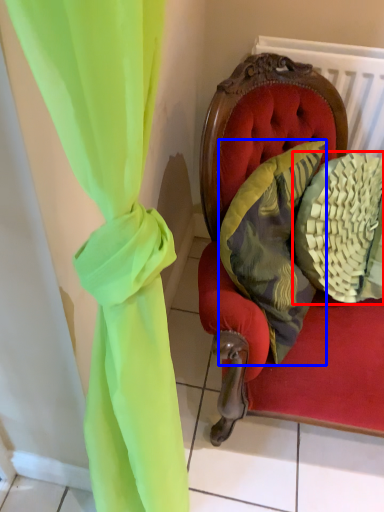
Question: Which point is further to the camera, pillow (highlighted by a red box) or pillow (highlighted by a blue box)?

Choices:
 (A) pillow
 (B) pillow

Answer: (A)